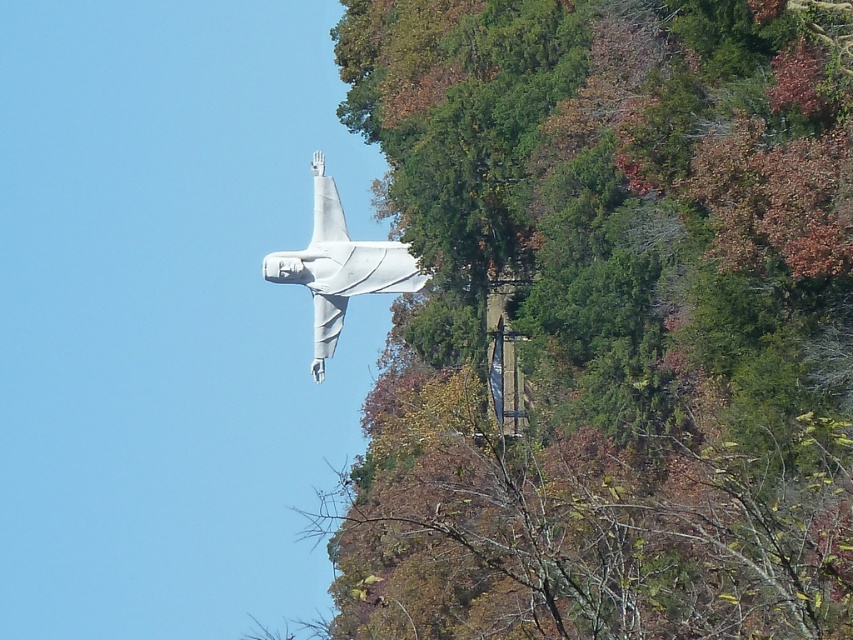
Does green leafy tree at upper center have a larger size compared to white matte statue at center?

Yes, green leafy tree at upper center is bigger than white matte statue at center.

In order to click on green leafy tree at upper center in this screenshot , I will do `click(605, 321)`.

Find the location of a particular element. This screenshot has width=853, height=640. green leafy tree at upper center is located at coordinates (605, 321).